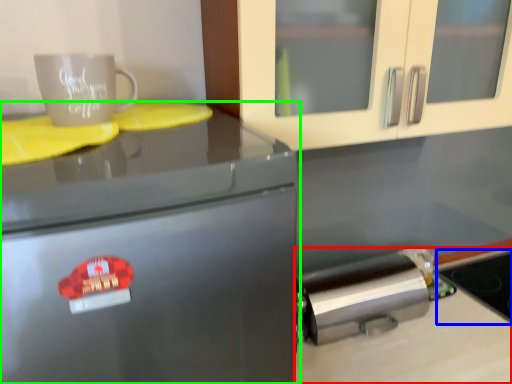
Question: Which object is positioned closest to counter top (highlighted by a red box)? Select from appliance (highlighted by a blue box) and home appliance (highlighted by a green box).

Choices:
 (A) appliance
 (B) home appliance

Answer: (A)